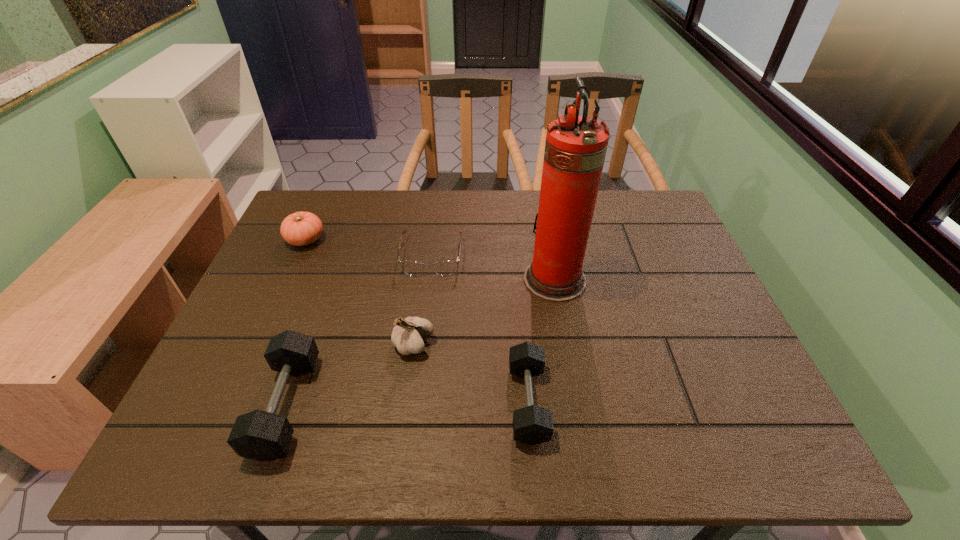
In the image, there is a desktop. Where is `vacant space at the far edge`? vacant space at the far edge is located at coordinates (383, 190).

Locate an element on the screen. The width and height of the screenshot is (960, 540). blank area at the near edge is located at coordinates (511, 376).

Where is `vacant region at the left edge of the desktop`? vacant region at the left edge of the desktop is located at coordinates (300, 298).

Find the location of a particular element. free region at the far left corner of the desktop is located at coordinates (309, 195).

This screenshot has height=540, width=960. I want to click on free spot at the near left corner of the desktop, so click(207, 396).

Where is `vacant space in between the shortest object and the fire extinguisher`? vacant space in between the shortest object and the fire extinguisher is located at coordinates (493, 268).

Where is `free point between the tomato and the tallest object`? Image resolution: width=960 pixels, height=540 pixels. free point between the tomato and the tallest object is located at coordinates (430, 260).

I want to click on empty space between the left dumbbell and the spectacles, so click(x=359, y=331).

At what (x,y) coordinates should I click in order to perform the action: click on free space between the garlic and the tomato. Please return your answer as a coordinate pair (x, y). Looking at the image, I should click on (360, 292).

Find the location of a particular element. This screenshot has width=960, height=540. empty space that is in between the tallest object and the leftmost object is located at coordinates (430, 260).